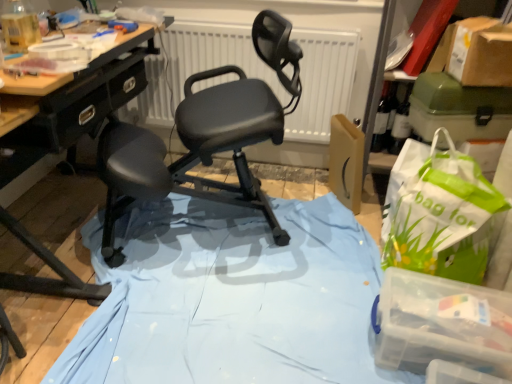
The height and width of the screenshot is (384, 512). Find the location of `free spot to the left of transparent plastic container at lower right, which is counted as the 2th box, starting from the top`. free spot to the left of transparent plastic container at lower right, which is counted as the 2th box, starting from the top is located at coordinates (322, 323).